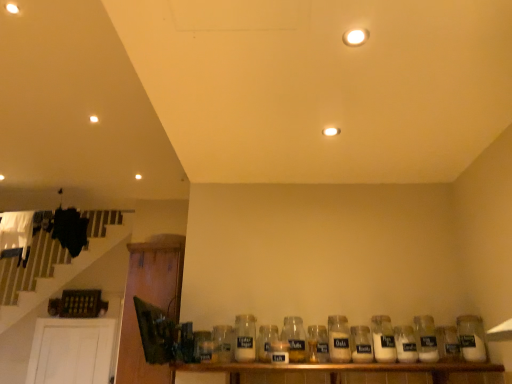
Question: Is white glass jar at center, which is the 8th bottle in left-to-right order, shorter than wooden shelf at lower center?

Choices:
 (A) no
 (B) yes

Answer: (A)

Question: Is white glass jar at center, positioned as the 4th bottle in right-to-left order, taller than wooden shelf at lower center?

Choices:
 (A) no
 (B) yes

Answer: (B)

Question: From a real-world perspective, is white glass jar at center, which is the 8th bottle in left-to-right order, physically above wooden shelf at lower center?

Choices:
 (A) no
 (B) yes

Answer: (B)

Question: Is white glass jar at center, which is the 8th bottle in left-to-right order, facing towards wooden shelf at lower center?

Choices:
 (A) yes
 (B) no

Answer: (B)

Question: Can wooden shelf at lower center be found inside white glass jar at center, which is the 8th bottle in left-to-right order?

Choices:
 (A) yes
 (B) no

Answer: (B)

Question: In terms of height, does matte white light fixture at center, positioned as the 3th lighting in top-to-bottom order, look taller or shorter compared to wooden shelf at lower center?

Choices:
 (A) tall
 (B) short

Answer: (B)

Question: Would you say matte white light fixture at center, which appears as the second lighting when viewed from the back, is inside or outside wooden shelf at lower center?

Choices:
 (A) inside
 (B) outside

Answer: (B)

Question: Considering the positions of point (327, 134) and point (298, 370), is point (327, 134) closer or farther from the camera than point (298, 370)?

Choices:
 (A) farther
 (B) closer

Answer: (B)

Question: From the image's perspective, is matte white light fixture at center, which appears as the second lighting when viewed from the back, positioned above or below wooden shelf at lower center?

Choices:
 (A) below
 (B) above

Answer: (B)

Question: Is point (327, 127) closer or farther from the camera than point (414, 354)?

Choices:
 (A) farther
 (B) closer

Answer: (B)

Question: In the image, is matte white light fixture at center, positioned as the 1th lighting in bottom-to-top order, on the left side or the right side of white glass bottle at center, which is counted as the 3th bottle, starting from the right?

Choices:
 (A) right
 (B) left

Answer: (B)

Question: Considering the positions of matte white light fixture at center, which appears as the first lighting when viewed from the right, and white glass bottle at center, the ninth bottle positioned from the left, in the image, is matte white light fixture at center, which appears as the first lighting when viewed from the right, taller or shorter than white glass bottle at center, the ninth bottle positioned from the left,?

Choices:
 (A) tall
 (B) short

Answer: (B)

Question: Looking at their shapes, would you say matte white light fixture at center, the second lighting from the front, is wider or thinner than white glass bottle at center, which is counted as the 3th bottle, starting from the right?

Choices:
 (A) thin
 (B) wide

Answer: (A)

Question: In the image, is clear glass jar at center, which is the seventh bottle in right-to-left order, positioned in front of or behind wooden shelf at lower center?

Choices:
 (A) front
 (B) behind

Answer: (B)

Question: Is point (321, 344) closer or farther from the camera than point (303, 382)?

Choices:
 (A) closer
 (B) farther

Answer: (B)